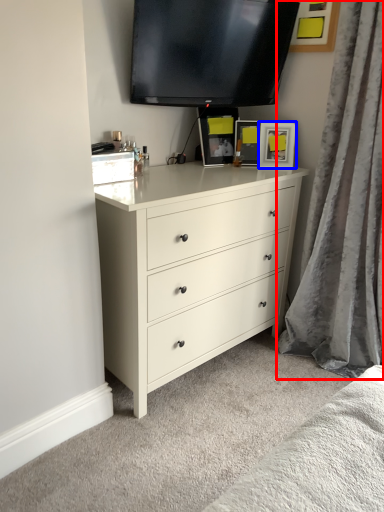
Question: Among these objects, which one is nearest to the camera, curtain (highlighted by a red box) or picture frame (highlighted by a blue box)?

Choices:
 (A) curtain
 (B) picture frame

Answer: (A)